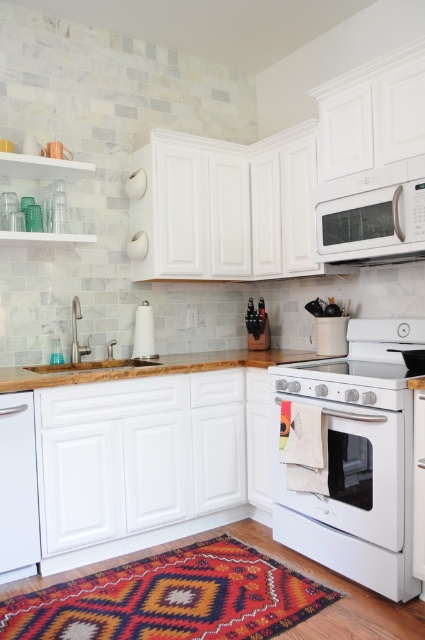
Does wooden countertop at lower center have a lesser height compared to wooden sink at lower left?

Yes.

Locate an element on the screen. This screenshot has height=640, width=425. wooden countertop at lower center is located at coordinates (144, 368).

Is point (65, 381) closer to camera compared to point (152, 316)?

Yes, point (65, 381) is in front of point (152, 316).

This screenshot has height=640, width=425. Find the location of `wooden countertop at lower center`. wooden countertop at lower center is located at coordinates (144, 368).

Looking at this image, is wooden sink at lower left positioned at the back of white glossy microwave at upper center?

Yes, it is behind white glossy microwave at upper center.

Between wooden sink at lower left and white glossy microwave at upper center, which one is positioned higher?

white glossy microwave at upper center

Identify the location of wooden sink at lower left. (113, 342).

Who is more forward, (419, 328) or (329, 264)?

Point (419, 328) is in front.

Is white glossy stove at lower right above white glossy microwave at upper center?

No.

The width and height of the screenshot is (425, 640). Find the location of `white glossy stove at lower right`. white glossy stove at lower right is located at coordinates (350, 458).